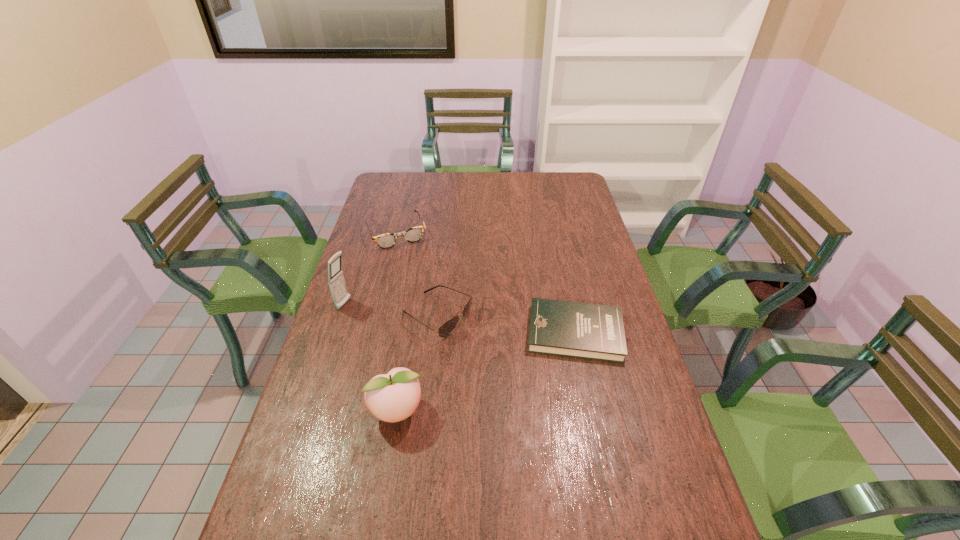
Image resolution: width=960 pixels, height=540 pixels. I want to click on object at the right edge, so click(x=592, y=331).

The image size is (960, 540). I want to click on vacant space at the far edge of the desktop, so click(478, 197).

At what (x,y) coordinates should I click in order to perform the action: click on vacant area at the near edge. Please return your answer as a coordinate pair (x, y). The width and height of the screenshot is (960, 540). Looking at the image, I should click on (583, 524).

You are a GUI agent. You are given a task and a screenshot of the screen. Output one action in this format:
    pyautogui.click(x=<x>, y=<y>)
    Task: Click on the vacant space at the left edge of the desktop
    The image size is (960, 540).
    Given the screenshot: What is the action you would take?
    pyautogui.click(x=358, y=295)

Find the location of `vacant space at the right edge`. vacant space at the right edge is located at coordinates (600, 248).

Where is `free space at the far left corner`? free space at the far left corner is located at coordinates (402, 197).

This screenshot has height=540, width=960. I want to click on blank space at the near right corner, so click(x=689, y=518).

Locate an element on the screen. vacant area that lies between the tallest object and the shortest object is located at coordinates (460, 319).

The image size is (960, 540). In order to click on vacant area between the book and the sunglasses in this screenshot , I will do `click(506, 325)`.

Image resolution: width=960 pixels, height=540 pixels. I want to click on vacant area that lies between the sunglasses and the rightmost object, so click(x=506, y=325).